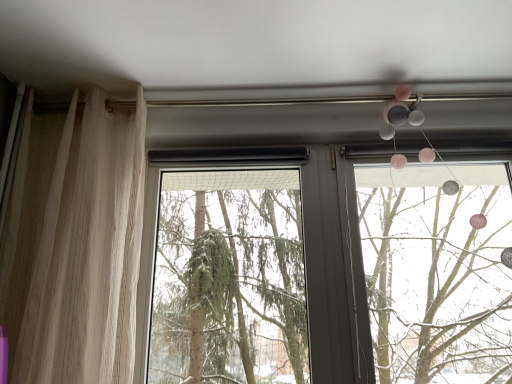
Question: Is sheer beige curtain at left far away from green matte tree at center?

Choices:
 (A) yes
 (B) no

Answer: (B)

Question: Is sheer beige curtain at left next to green matte tree at center and touching it?

Choices:
 (A) no
 (B) yes

Answer: (A)

Question: Can you confirm if sheer beige curtain at left is positioned to the left of green matte tree at center?

Choices:
 (A) no
 (B) yes

Answer: (B)

Question: Is green matte tree at center at the back of sheer beige curtain at left?

Choices:
 (A) no
 (B) yes

Answer: (A)

Question: Is sheer beige curtain at left further to camera compared to green matte tree at center?

Choices:
 (A) yes
 (B) no

Answer: (B)

Question: Which is correct: green matte tree at center is inside sheer beige curtain at left, or outside of it?

Choices:
 (A) inside
 (B) outside

Answer: (B)

Question: From the image's perspective, is green matte tree at center above or below sheer beige curtain at left?

Choices:
 (A) above
 (B) below

Answer: (B)

Question: From a real-world perspective, is green matte tree at center above or below sheer beige curtain at left?

Choices:
 (A) above
 (B) below

Answer: (B)

Question: In the image, is green matte tree at center on the left side or the right side of sheer beige curtain at left?

Choices:
 (A) right
 (B) left

Answer: (A)

Question: Is sheer beige curtain at left taller or shorter than matte plastic mobile at upper right?

Choices:
 (A) short
 (B) tall

Answer: (B)

Question: Is point (75, 362) closer or farther from the camera than point (433, 261)?

Choices:
 (A) closer
 (B) farther

Answer: (A)

Question: Looking at the image, does sheer beige curtain at left seem bigger or smaller compared to matte plastic mobile at upper right?

Choices:
 (A) big
 (B) small

Answer: (A)

Question: Is sheer beige curtain at left inside the boundaries of matte plastic mobile at upper right, or outside?

Choices:
 (A) outside
 (B) inside

Answer: (A)

Question: Would you say sheer beige curtain at left is inside or outside green matte tree at center?

Choices:
 (A) outside
 (B) inside

Answer: (A)

Question: In terms of height, does sheer beige curtain at left look taller or shorter compared to green matte tree at center?

Choices:
 (A) tall
 (B) short

Answer: (A)